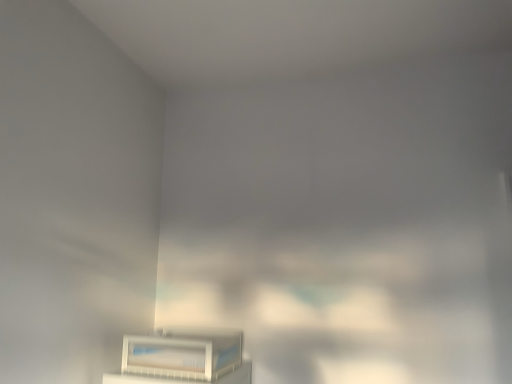
Image resolution: width=512 pixels, height=384 pixels. Describe the element at coordinates (183, 354) in the screenshot. I see `white plastic air conditioner at lower center` at that location.

At what (x,y) coordinates should I click in order to perform the action: click on white plastic air conditioner at lower center. Please return your answer as a coordinate pair (x, y). Image resolution: width=512 pixels, height=384 pixels. Looking at the image, I should click on (183, 354).

Image resolution: width=512 pixels, height=384 pixels. I want to click on white plastic air conditioner at lower center, so click(183, 354).